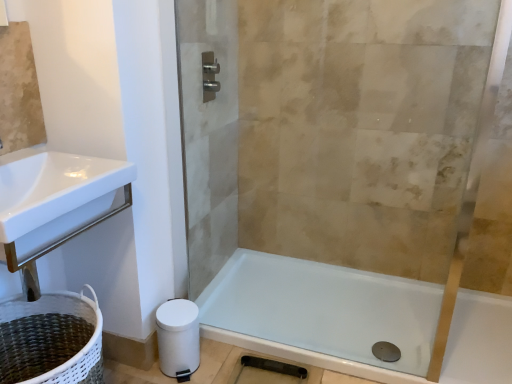
Question: Can you see white woven laundry basket at lower left touching white matte toilet paper at lower left?

Choices:
 (A) yes
 (B) no

Answer: (B)

Question: Is there a large distance between white woven laundry basket at lower left and white matte toilet paper at lower left?

Choices:
 (A) no
 (B) yes

Answer: (A)

Question: Is white woven laundry basket at lower left positioned in front of white matte toilet paper at lower left?

Choices:
 (A) no
 (B) yes

Answer: (B)

Question: Considering the relative sizes of white woven laundry basket at lower left and white matte toilet paper at lower left in the image provided, is white woven laundry basket at lower left wider than white matte toilet paper at lower left?

Choices:
 (A) no
 (B) yes

Answer: (B)

Question: Is white woven laundry basket at lower left to the right of white matte toilet paper at lower left from the viewer's perspective?

Choices:
 (A) no
 (B) yes

Answer: (A)

Question: From the image's perspective, is clear glass shower door at center located above or below white glossy bathtub at lower right?

Choices:
 (A) below
 (B) above

Answer: (B)

Question: In the image, is clear glass shower door at center on the left side or the right side of white glossy bathtub at lower right?

Choices:
 (A) left
 (B) right

Answer: (A)

Question: Would you say clear glass shower door at center is inside or outside white glossy bathtub at lower right?

Choices:
 (A) outside
 (B) inside

Answer: (A)

Question: Is point (199, 79) closer or farther from the camera than point (397, 289)?

Choices:
 (A) closer
 (B) farther

Answer: (A)

Question: From a real-world perspective, is white matte toilet paper at lower left above or below satin nickel towel bar at upper center?

Choices:
 (A) above
 (B) below

Answer: (B)

Question: Is point (187, 370) closer or farther from the camera than point (211, 57)?

Choices:
 (A) farther
 (B) closer

Answer: (B)

Question: Considering their positions, is white matte toilet paper at lower left located in front of or behind satin nickel towel bar at upper center?

Choices:
 (A) front
 (B) behind

Answer: (A)

Question: Is white matte toilet paper at lower left inside or outside of satin nickel towel bar at upper center?

Choices:
 (A) outside
 (B) inside

Answer: (A)

Question: From the image's perspective, is white glossy bathtub at lower right positioned above or below satin nickel towel bar at upper center?

Choices:
 (A) below
 (B) above

Answer: (A)

Question: In terms of size, does white glossy bathtub at lower right appear bigger or smaller than satin nickel towel bar at upper center?

Choices:
 (A) big
 (B) small

Answer: (A)